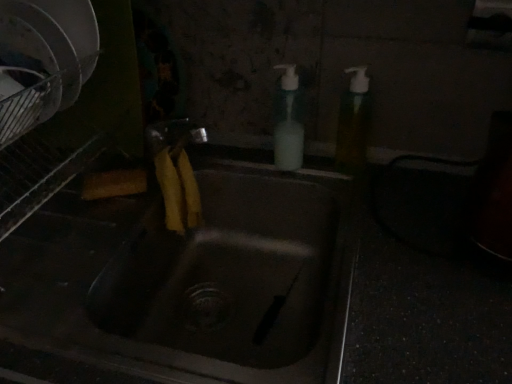
Question: From the image's perspective, is translucent plastic soap dispenser at upper right, marked as the 1th soap dispenser in a right-to-left arrangement, beneath matte stainless steel sink at center?

Choices:
 (A) yes
 (B) no

Answer: (B)

Question: From a real-world perspective, is translucent plastic soap dispenser at upper right, which appears as the second soap dispenser when viewed from the left, physically above matte stainless steel sink at center?

Choices:
 (A) no
 (B) yes

Answer: (B)

Question: Is translucent plastic soap dispenser at upper right, marked as the 1th soap dispenser in a right-to-left arrangement, oriented towards matte stainless steel sink at center?

Choices:
 (A) no
 (B) yes

Answer: (A)

Question: Is matte stainless steel sink at center inside translucent plastic soap dispenser at upper right, marked as the 1th soap dispenser in a right-to-left arrangement?

Choices:
 (A) yes
 (B) no

Answer: (B)

Question: Is translucent plastic soap dispenser at upper right, which appears as the second soap dispenser when viewed from the left, further to the viewer compared to matte stainless steel sink at center?

Choices:
 (A) no
 (B) yes

Answer: (B)

Question: Is white plastic soap dispenser at upper center, arranged as the 1th soap dispenser when viewed from the left, to the left or to the right of matte stainless steel sink at center in the image?

Choices:
 (A) right
 (B) left

Answer: (A)

Question: Which is correct: white plastic soap dispenser at upper center, which appears as the 2th soap dispenser when viewed from the right, is inside matte stainless steel sink at center, or outside of it?

Choices:
 (A) outside
 (B) inside

Answer: (A)

Question: From a real-world perspective, relative to matte stainless steel sink at center, is white plastic soap dispenser at upper center, which appears as the 2th soap dispenser when viewed from the right, vertically above or below?

Choices:
 (A) below
 (B) above

Answer: (B)

Question: From the image's perspective, is white plastic soap dispenser at upper center, arranged as the 1th soap dispenser when viewed from the left, located above or below matte stainless steel sink at center?

Choices:
 (A) below
 (B) above

Answer: (B)

Question: Is translucent plastic soap dispenser at upper right, marked as the 1th soap dispenser in a right-to-left arrangement, spatially inside matte stainless steel sink at center, or outside of it?

Choices:
 (A) inside
 (B) outside

Answer: (B)

Question: From a real-world perspective, relative to matte stainless steel sink at center, is translucent plastic soap dispenser at upper right, which appears as the second soap dispenser when viewed from the left, vertically above or below?

Choices:
 (A) below
 (B) above

Answer: (B)

Question: Is translucent plastic soap dispenser at upper right, marked as the 1th soap dispenser in a right-to-left arrangement, taller or shorter than matte stainless steel sink at center?

Choices:
 (A) short
 (B) tall

Answer: (A)

Question: In terms of size, does translucent plastic soap dispenser at upper right, marked as the 1th soap dispenser in a right-to-left arrangement, appear bigger or smaller than matte stainless steel sink at center?

Choices:
 (A) small
 (B) big

Answer: (A)

Question: Considering the positions of matte stainless steel sink at center and translucent plastic soap dispenser at upper right, which appears as the second soap dispenser when viewed from the left, in the image, is matte stainless steel sink at center taller or shorter than translucent plastic soap dispenser at upper right, which appears as the second soap dispenser when viewed from the left,?

Choices:
 (A) short
 (B) tall

Answer: (B)

Question: Is point (287, 329) closer or farther from the camera than point (335, 158)?

Choices:
 (A) closer
 (B) farther

Answer: (A)